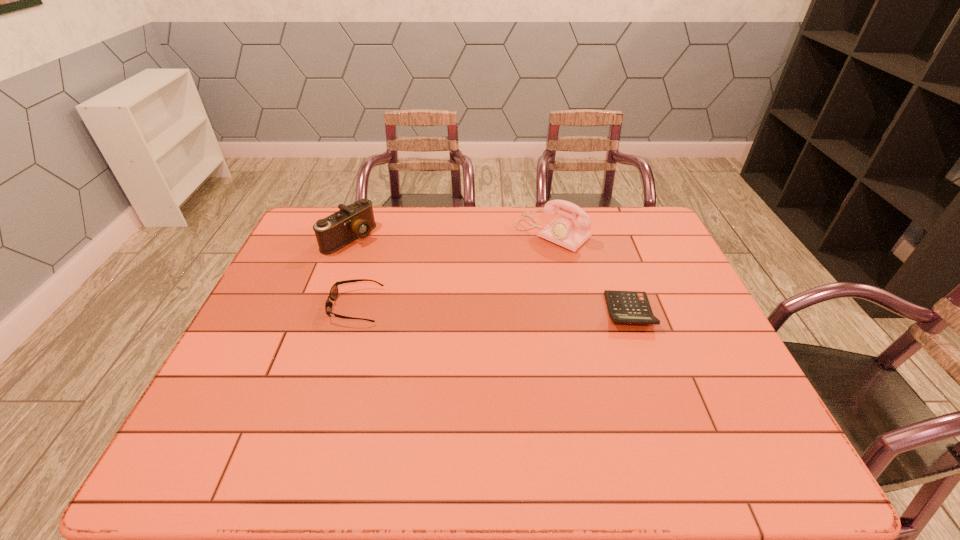
The height and width of the screenshot is (540, 960). Identify the location of vacant space at the near edge. (485, 392).

Identify the location of free spot at the left edge of the desktop. (275, 369).

I want to click on vacant space at the right edge of the desktop, so 670,253.

Locate an element on the screen. free region at the far left corner of the desktop is located at coordinates (302, 231).

You are a GUI agent. You are given a task and a screenshot of the screen. Output one action in this format:
    pyautogui.click(x=<x>, y=<y>)
    Task: Click on the free space at the near left corner
    The height and width of the screenshot is (540, 960).
    Given the screenshot: What is the action you would take?
    pyautogui.click(x=217, y=424)

The height and width of the screenshot is (540, 960). In the image, there is a desktop. Find the location of `vacant area at the near right corner`. vacant area at the near right corner is located at coordinates (736, 417).

Identify the location of vacant space that is in between the sunglasses and the tallest object. (454, 270).

In order to click on vacant region between the telephone and the sunglasses in this screenshot , I will do `click(454, 270)`.

Where is `unoccupied position between the tallest object and the calculator`? This screenshot has width=960, height=540. unoccupied position between the tallest object and the calculator is located at coordinates (591, 273).

The width and height of the screenshot is (960, 540). Identify the location of free space between the tallest object and the calculator. (591, 273).